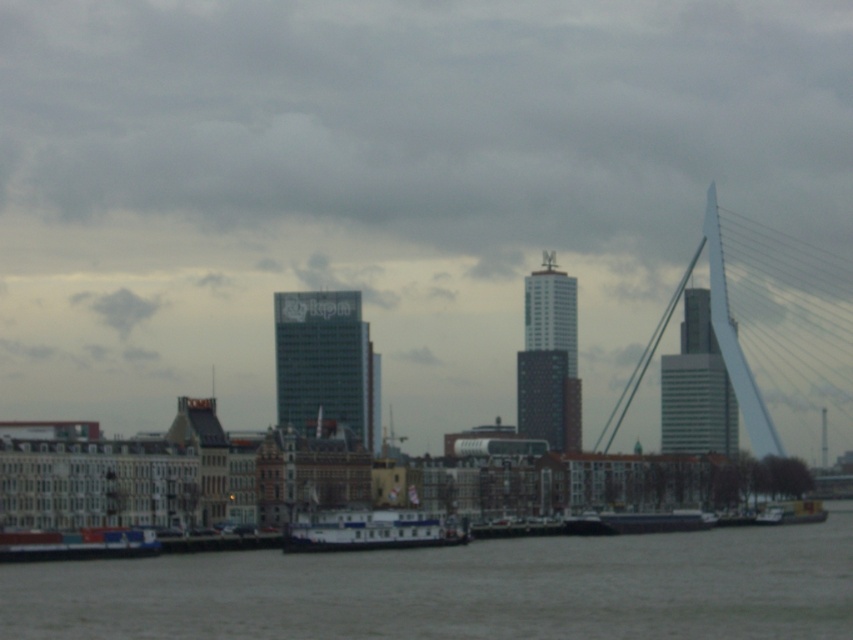
Measure the distance between white glass bridge at right and camera.

The distance of white glass bridge at right from camera is 330.40 meters.

How distant is white glass bridge at right from white matte boat at lower center?

They are 269.76 meters apart.

This screenshot has width=853, height=640. I want to click on white glass bridge at right, so click(x=766, y=326).

In the scene shown: Is gray concrete water at lower center wider than white matte boat at lower center?

Yes.

Is point (529, 552) closer to viewer compared to point (421, 509)?

Yes.

Identify the location of gray concrete water at lower center. This screenshot has width=853, height=640. (460, 589).

Who is more forward, (730, 570) or (814, 388)?

Positioned in front is point (730, 570).

Is point (769, 548) more distant than point (846, 353)?

No, (769, 548) is in front of (846, 353).

The width and height of the screenshot is (853, 640). I want to click on gray concrete water at lower center, so click(x=460, y=589).